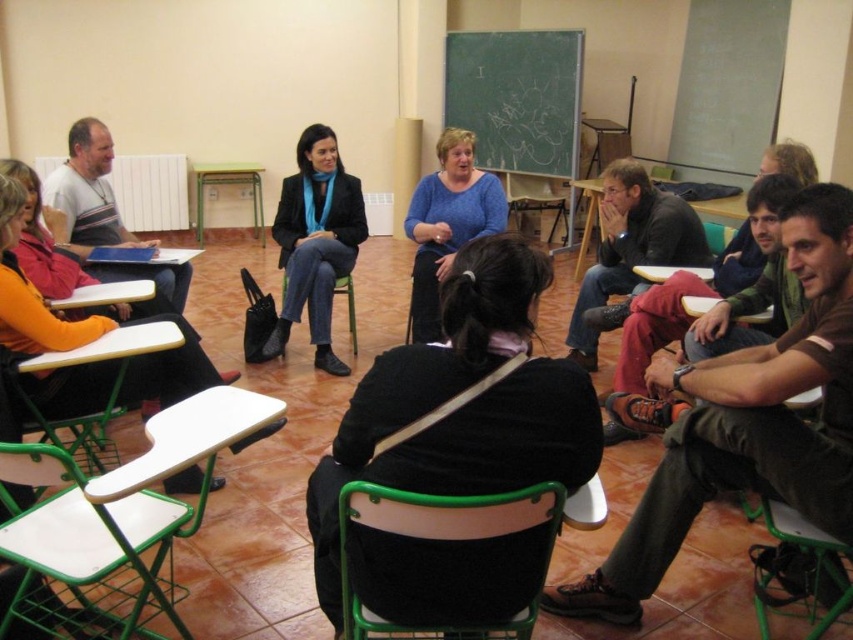
You are a student sitting in the classroom and need to write something on the green chalkboard at upper center. Can you reach it from your current position at the green plastic chair at lower left without moving your chair?

The green chalkboard at upper center is above the green plastic chair at lower left, so yes, you can reach it from your current position at the green plastic chair at lower left as it is positioned above you.

You are a person who is 1.7 meters tall. You are sitting on the green plastic chair at lower center and want to reach a book placed on the green plastic chair at lower left. Can you comfortably reach the book without standing up?

The green plastic chair at lower center is shorter than the green plastic chair at lower left. Since the chair you are sitting on is shorter, you may have difficulty comfortably reaching the book on the taller chair without standing up.

You are sitting in the green plastic chair at lower center and want to pass a note to the person sitting in the green plastic chair at lower left. Which direction should you pass the note to reach them?

The green plastic chair at lower center is below the green plastic chair at lower left, so you should pass the note upwards to reach the person in the green plastic chair at lower left.